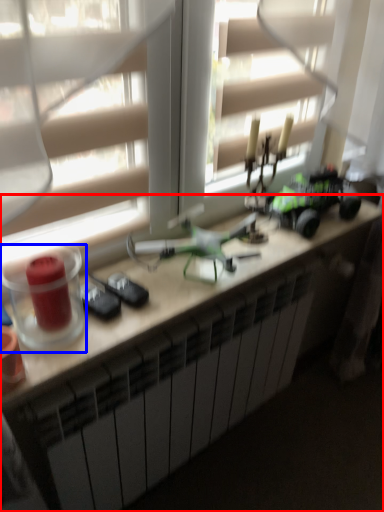
Question: Which of the following is the closest to the observer, desk (highlighted by a red box) or candle holder (highlighted by a blue box)?

Choices:
 (A) desk
 (B) candle holder

Answer: (B)